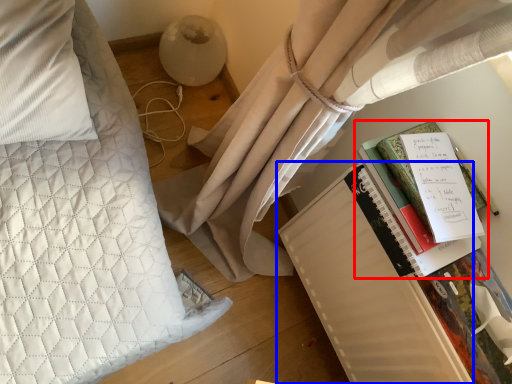
Question: Which of the following is the farthest to the observer, book (highlighted by a red box) or paperback book (highlighted by a blue box)?

Choices:
 (A) book
 (B) paperback book

Answer: (B)